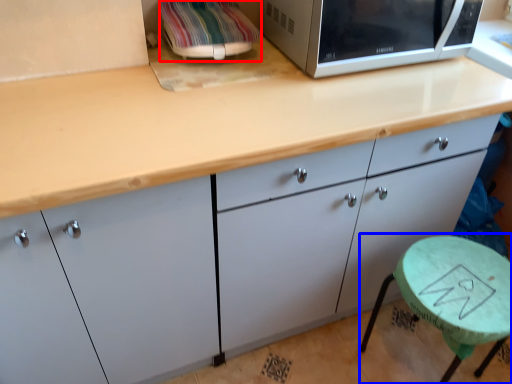
Question: Which of the following is the farthest to the observer, appliance (highlighted by a red box) or round table (highlighted by a blue box)?

Choices:
 (A) appliance
 (B) round table

Answer: (A)